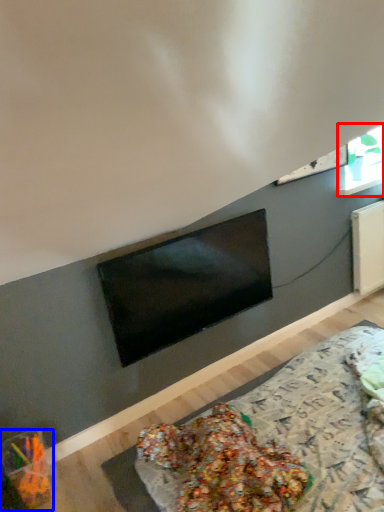
Question: Which object is closer to the camera taking this photo, window (highlighted by a red box) or food (highlighted by a blue box)?

Choices:
 (A) window
 (B) food

Answer: (B)